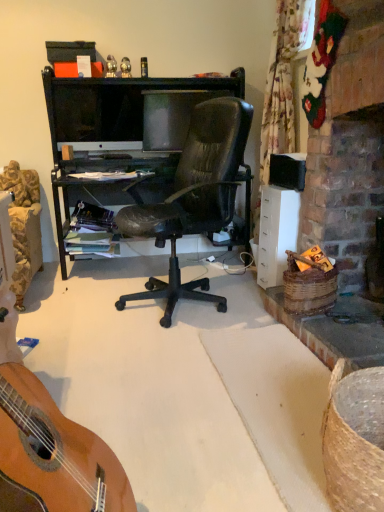
The height and width of the screenshot is (512, 384). I want to click on matte black box at upper center, so click(x=69, y=51).

The width and height of the screenshot is (384, 512). I want to click on matte black monitor at center, marked as the first television in a right-to-left arrangement, so click(x=171, y=116).

You are a GUI agent. You are given a task and a screenshot of the screen. Output one action in this format:
    pyautogui.click(x=<x>, y=<y>)
    Task: Click on the light brown wooden guitar at lower left
    
    Given the screenshot: What is the action you would take?
    pyautogui.click(x=56, y=451)

Find the location of a particular element. This screenshot has height=512, width=384. matte black monitor at center, which is counted as the 2th television, starting from the right is located at coordinates (97, 113).

Find the location of a particular element. matte black box at upper center is located at coordinates (69, 51).

Considering the sizes of objects brown woven picnic basket at right, the first picnic basket when ordered from top to bottom, and light brown wooden guitar at lower left in the image provided, who is shorter, brown woven picnic basket at right, the first picnic basket when ordered from top to bottom, or light brown wooden guitar at lower left?

With less height is brown woven picnic basket at right, the first picnic basket when ordered from top to bottom.

Is brown woven picnic basket at right, marked as the first picnic basket in a back-to-front arrangement, oriented towards light brown wooden guitar at lower left?

No, brown woven picnic basket at right, marked as the first picnic basket in a back-to-front arrangement, is not turned towards light brown wooden guitar at lower left.

Is brown woven picnic basket at right, marked as the first picnic basket in a back-to-front arrangement, with light brown wooden guitar at lower left?

No, brown woven picnic basket at right, marked as the first picnic basket in a back-to-front arrangement, is not making contact with light brown wooden guitar at lower left.

From a real-world perspective, who is located higher, brown woven picnic basket at right, the second picnic basket from the front, or light brown wooden guitar at lower left?

light brown wooden guitar at lower left, from a real-world perspective.

Locate an element on the screen. This screenshot has width=384, height=512. the 2nd picnic basket in front when counting from the matte black monitor at center, which is the second television in left-to-right order is located at coordinates (x=354, y=439).

Does point (168, 145) lie in front of point (355, 404)?

That is False.

Is matte black monitor at center, which is the second television in left-to-right order, with brown woven picnic basket at lower right, the 1th picnic basket from the front?

No, matte black monitor at center, which is the second television in left-to-right order, is not making contact with brown woven picnic basket at lower right, the 1th picnic basket from the front.

Between light brown wooden guitar at lower left and matte black monitor at center, marked as the first television in a right-to-left arrangement, which one appears on the left side from the viewer's perspective?

light brown wooden guitar at lower left is more to the left.

From the picture: Is light brown wooden guitar at lower left in front of or behind matte black monitor at center, which is the second television in left-to-right order, in the image?

light brown wooden guitar at lower left is in front of matte black monitor at center, which is the second television in left-to-right order.

Is matte black monitor at center, which is the second television in left-to-right order, at the back of light brown wooden guitar at lower left?

No, light brown wooden guitar at lower left is not facing the opposite direction of matte black monitor at center, which is the second television in left-to-right order.

Is point (28, 436) in front of point (189, 121)?

That is True.

Is matte black monitor at center, marked as the first television in a right-to-left arrangement, smaller than matte black box at upper center?

No.

The height and width of the screenshot is (512, 384). What are the coordinates of `box on the left of matte black monitor at center, marked as the first television in a right-to-left arrangement` in the screenshot? It's located at (69, 51).

Do you think matte black monitor at center, which is the second television in left-to-right order, is within matte black box at upper center, or outside of it?

matte black monitor at center, which is the second television in left-to-right order, cannot be found inside matte black box at upper center.

Is matte black monitor at center, which is the second television in left-to-right order, to the left of matte black box at upper center from the viewer's perspective?

No, matte black monitor at center, which is the second television in left-to-right order, is not to the left of matte black box at upper center.

From a real-world perspective, who is located higher, matte black monitor at center, marked as the first television in a right-to-left arrangement, or brown woven picnic basket at right, the 2th picnic basket ordered from the bottom?

From a 3D spatial view, matte black monitor at center, marked as the first television in a right-to-left arrangement, is above.

Looking at this image, does matte black monitor at center, marked as the first television in a right-to-left arrangement, have a lesser width compared to brown woven picnic basket at right, the second picnic basket from the front?

Indeed, matte black monitor at center, marked as the first television in a right-to-left arrangement, has a lesser width compared to brown woven picnic basket at right, the second picnic basket from the front.

Which is more to the right, matte black monitor at center, which is the second television in left-to-right order, or brown woven picnic basket at right, the 2th picnic basket ordered from the bottom?

brown woven picnic basket at right, the 2th picnic basket ordered from the bottom.

Is point (375, 435) positioned in front of point (139, 110)?

Yes, it is.

Is brown woven picnic basket at lower right, which ranks as the 1th picnic basket in bottom-to-top order, shorter than matte black monitor at center, which is counted as the 2th television, starting from the right?

Yes, brown woven picnic basket at lower right, which ranks as the 1th picnic basket in bottom-to-top order, is shorter than matte black monitor at center, which is counted as the 2th television, starting from the right.

In terms of size, does brown woven picnic basket at lower right, the 1th picnic basket from the front, appear bigger or smaller than matte black monitor at center, marked as the 1th television in a left-to-right arrangement?

Clearly, brown woven picnic basket at lower right, the 1th picnic basket from the front, is smaller in size than matte black monitor at center, marked as the 1th television in a left-to-right arrangement.

Can you see brown woven picnic basket at lower right, which is the 2th picnic basket in top-to-bottom order, touching matte black monitor at center, which is counted as the 2th television, starting from the right?

No, brown woven picnic basket at lower right, which is the 2th picnic basket in top-to-bottom order, is not making contact with matte black monitor at center, which is counted as the 2th television, starting from the right.

Looking at the image, does matte black monitor at center, which is counted as the 2th television, starting from the right, seem bigger or smaller compared to brown woven picnic basket at lower right, which ranks as the 2th picnic basket in back-to-front order?

Considering their sizes, matte black monitor at center, which is counted as the 2th television, starting from the right, takes up more space than brown woven picnic basket at lower right, which ranks as the 2th picnic basket in back-to-front order.

In the scene shown: Which is correct: matte black monitor at center, which is counted as the 2th television, starting from the right, is inside brown woven picnic basket at lower right, which is the 2th picnic basket in top-to-bottom order, or outside of it?

The correct answer is: outside.

Which picnic basket is the 2nd one when counting from the front of the matte black monitor at center, marked as the 1th television in a left-to-right arrangement? Please provide its 2D coordinates.

[(354, 439)]

Which is in front, point (126, 106) or point (350, 476)?

The point (350, 476) is closer.

From the light brown wooden guitar at lower left, count 2nd picnic basket to the right and point to it. Please provide its 2D coordinates.

[(309, 285)]

From the image's perspective, starting from the matte black monitor at center, which is the second television in left-to-right order, which picnic basket is the 2nd one below? Please provide its 2D coordinates.

[(354, 439)]

Looking at the image, which one is located closer to brown woven picnic basket at lower right, which ranks as the 2th picnic basket in back-to-front order, matte black monitor at center, which is the second television in left-to-right order, or matte black monitor at center, which is counted as the 2th television, starting from the right?

The object closer to brown woven picnic basket at lower right, which ranks as the 2th picnic basket in back-to-front order, is matte black monitor at center, which is the second television in left-to-right order.

When comparing their distances from brown woven picnic basket at lower right, which ranks as the 1th picnic basket in bottom-to-top order, does matte black monitor at center, marked as the 1th television in a left-to-right arrangement, or brown woven picnic basket at right, the second picnic basket from the front, seem further?

matte black monitor at center, marked as the 1th television in a left-to-right arrangement.

Based on the photo, when comparing their distances from matte black monitor at center, which is the second television in left-to-right order, does matte black box at upper center or brown woven picnic basket at lower right, which ranks as the 2th picnic basket in back-to-front order, seem closer?

Among the two, matte black box at upper center is located nearer to matte black monitor at center, which is the second television in left-to-right order.

Estimate the real-world distances between objects in this image. Which object is further from brown woven picnic basket at lower right, which ranks as the 1th picnic basket in bottom-to-top order, matte black monitor at center, marked as the first television in a right-to-left arrangement, or matte black box at upper center?

Among the two, matte black box at upper center is located further to brown woven picnic basket at lower right, which ranks as the 1th picnic basket in bottom-to-top order.

Estimate the real-world distances between objects in this image. Which object is closer to light brown wooden guitar at lower left, matte black box at upper center or brown woven picnic basket at lower right, which ranks as the 1th picnic basket in bottom-to-top order?

brown woven picnic basket at lower right, which ranks as the 1th picnic basket in bottom-to-top order.

Which object lies further to the anchor point light brown wooden guitar at lower left, matte black monitor at center, marked as the 1th television in a left-to-right arrangement, or matte black box at upper center?

matte black box at upper center lies further to light brown wooden guitar at lower left than the other object.

Looking at the image, which one is located further to matte black monitor at center, which is the second television in left-to-right order, brown woven picnic basket at lower right, which is the 2th picnic basket in top-to-bottom order, or matte black monitor at center, marked as the 1th television in a left-to-right arrangement?

brown woven picnic basket at lower right, which is the 2th picnic basket in top-to-bottom order, lies further to matte black monitor at center, which is the second television in left-to-right order, than the other object.

Based on their spatial positions, is brown woven picnic basket at right, the first picnic basket when ordered from top to bottom, or matte black monitor at center, marked as the 1th television in a left-to-right arrangement, closer to matte black monitor at center, which is the second television in left-to-right order?

matte black monitor at center, marked as the 1th television in a left-to-right arrangement, lies closer to matte black monitor at center, which is the second television in left-to-right order, than the other object.

The height and width of the screenshot is (512, 384). In order to click on box positioned between brown woven picnic basket at lower right, which ranks as the 2th picnic basket in back-to-front order, and matte black monitor at center, which is counted as the 2th television, starting from the right, from near to far in this screenshot , I will do `click(69, 51)`.

Locate an element on the screen. This screenshot has height=512, width=384. television that lies between matte black monitor at center, marked as the first television in a right-to-left arrangement, and brown woven picnic basket at right, the 2th picnic basket ordered from the bottom, from top to bottom is located at coordinates (97, 113).

The width and height of the screenshot is (384, 512). What are the coordinates of `television between light brown wooden guitar at lower left and matte black monitor at center, which is the second television in left-to-right order, in the front-back direction` in the screenshot? It's located at (97, 113).

The image size is (384, 512). In order to click on box located between brown woven picnic basket at lower right, which ranks as the 1th picnic basket in bottom-to-top order, and matte black monitor at center, marked as the first television in a right-to-left arrangement, in the depth direction in this screenshot , I will do `click(69, 51)`.